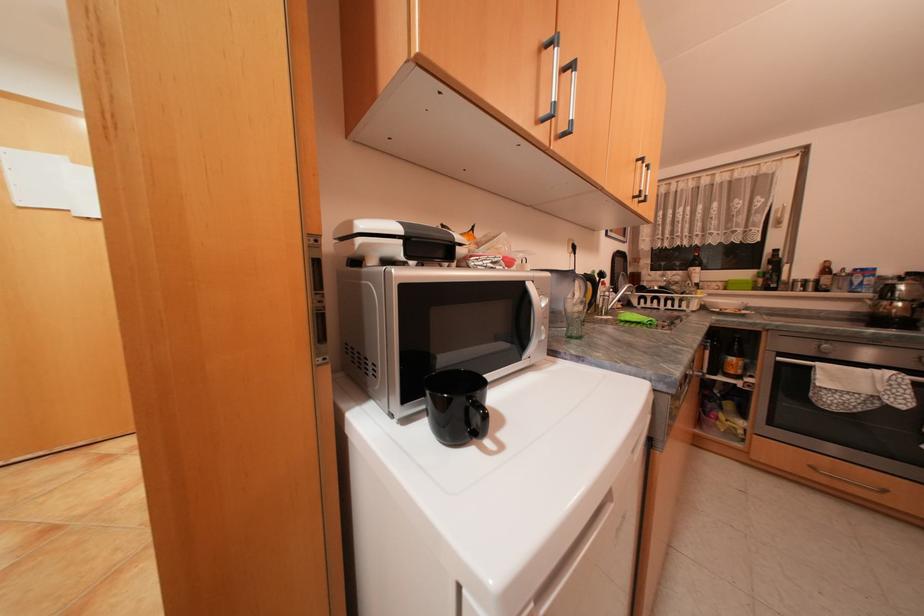
The image size is (924, 616). What do you see at coordinates (478, 419) in the screenshot?
I see `the black mug handle` at bounding box center [478, 419].